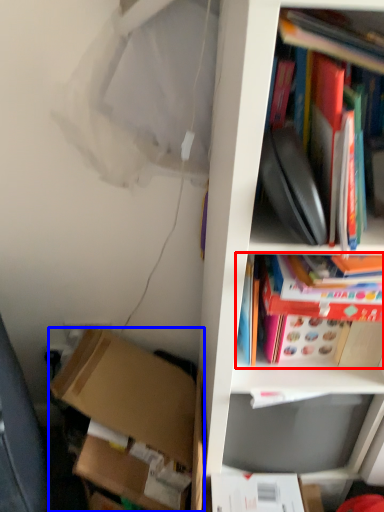
Question: Which object appears closest to the camera in this image, book (highlighted by a red box) or box (highlighted by a blue box)?

Choices:
 (A) book
 (B) box

Answer: (A)